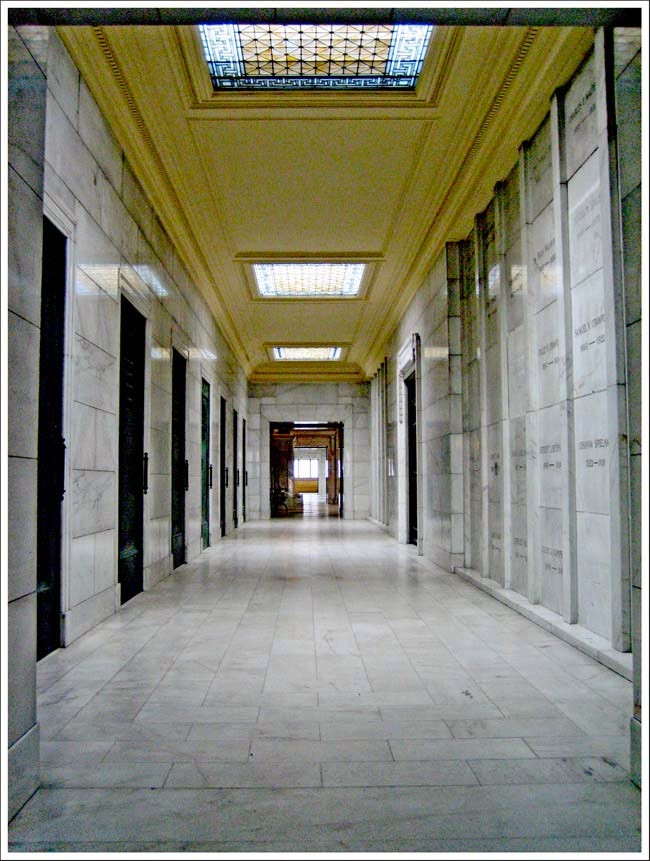
Locate an element on the screen. The width and height of the screenshot is (650, 861). back window is located at coordinates (306, 461).